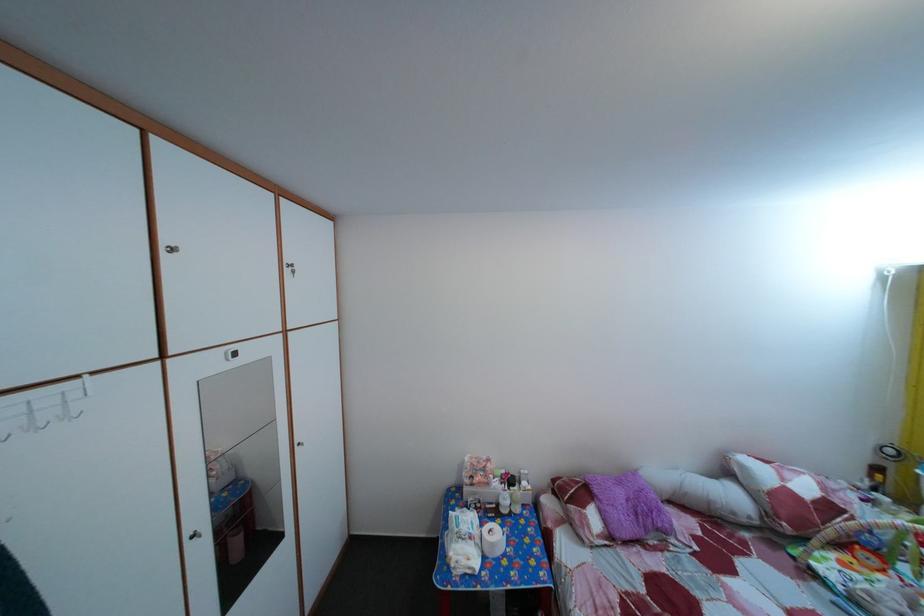
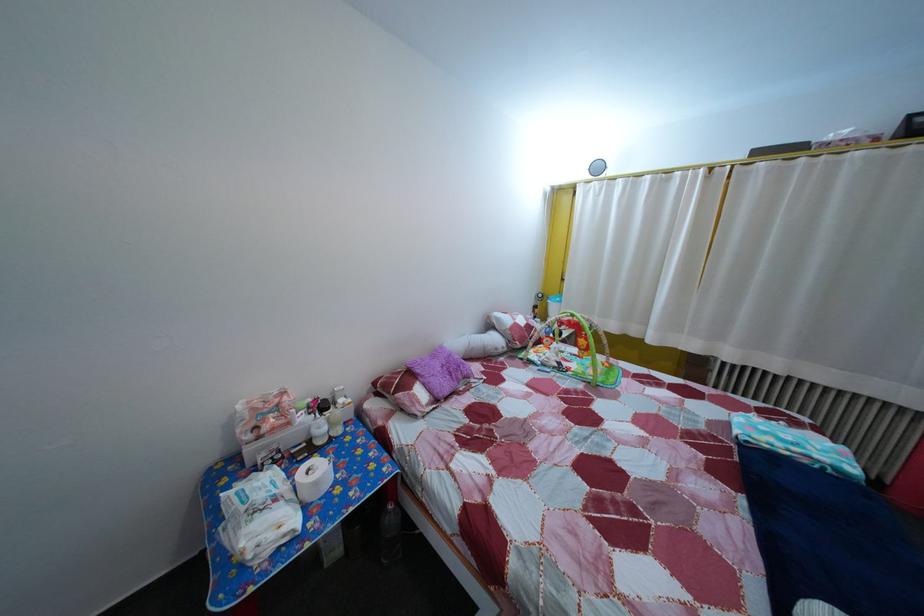
Find the pixel in the second image that matches (497,493) in the first image.

(298, 432)